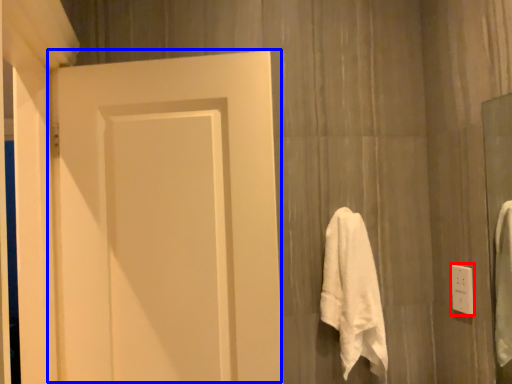
Question: Among these objects, which one is nearest to the camera, electric outlet (highlighted by a red box) or door (highlighted by a blue box)?

Choices:
 (A) electric outlet
 (B) door

Answer: (B)